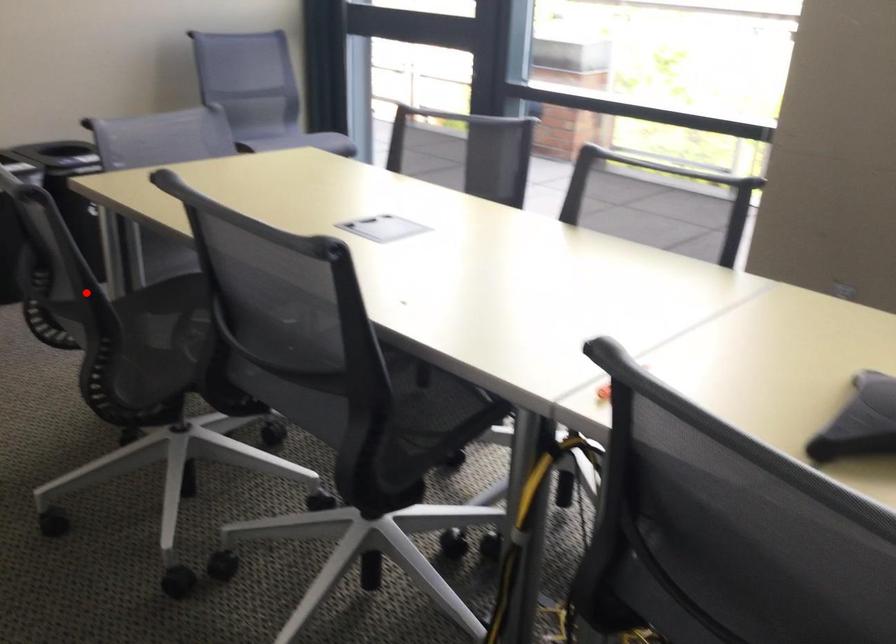
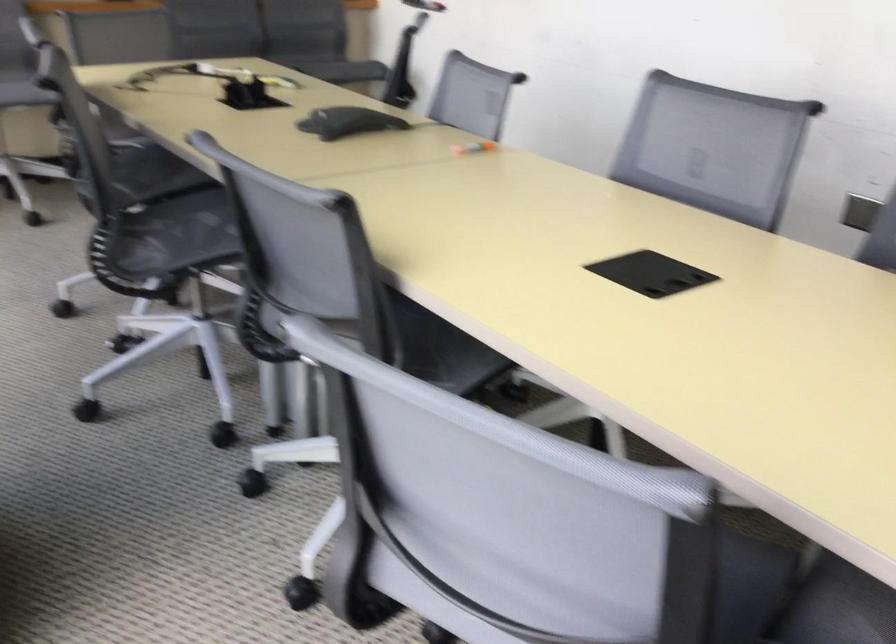
Question: A red point is marked in image1. In image2, is the corresponding 3D point closer to the camera or farther? Reply with the corresponding letter.

Choices:
 (A) The corresponding 3D point is closer.
 (B) The corresponding 3D point is farther.

Answer: (B)